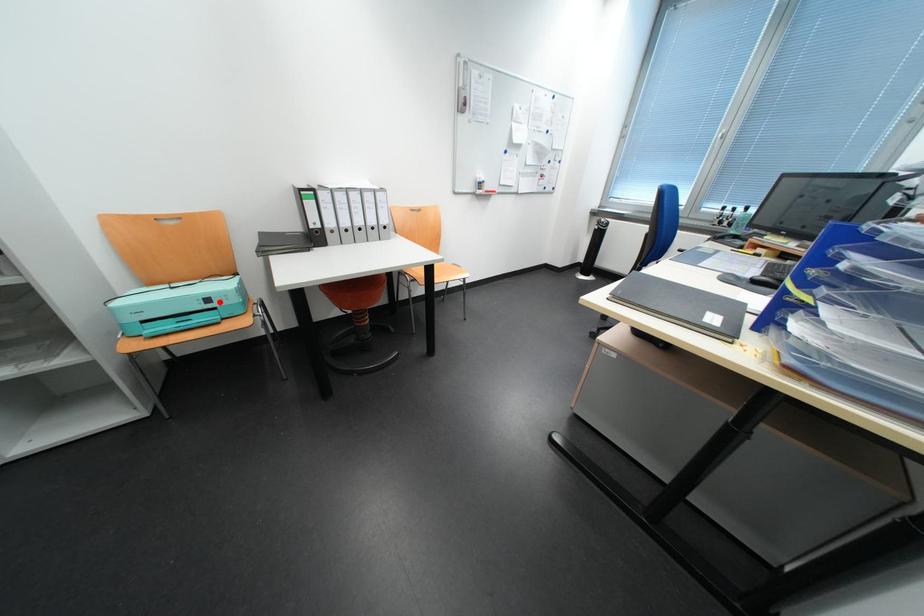
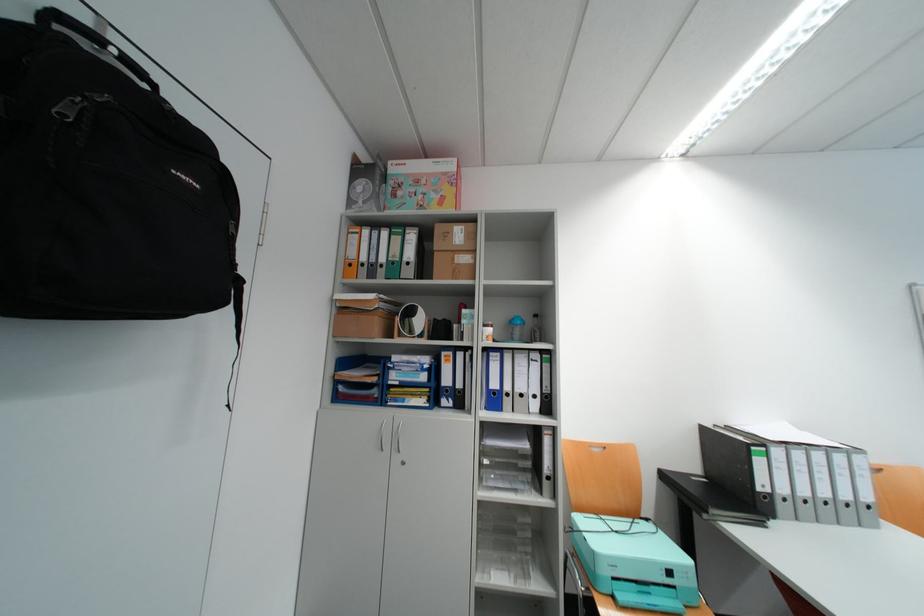
The point at the highlighted location is marked in the first image. Where is the corresponding point in the second image?

(682, 573)